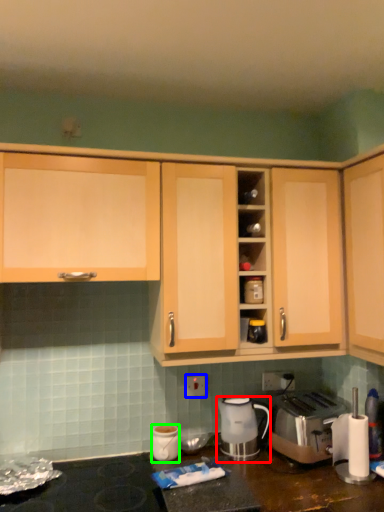
Question: Considering the real-world distances, which object is farthest from home appliance (highlighted by a red box)? electric outlet (highlighted by a blue box) or kitchen appliance (highlighted by a green box)?

Choices:
 (A) electric outlet
 (B) kitchen appliance

Answer: (B)